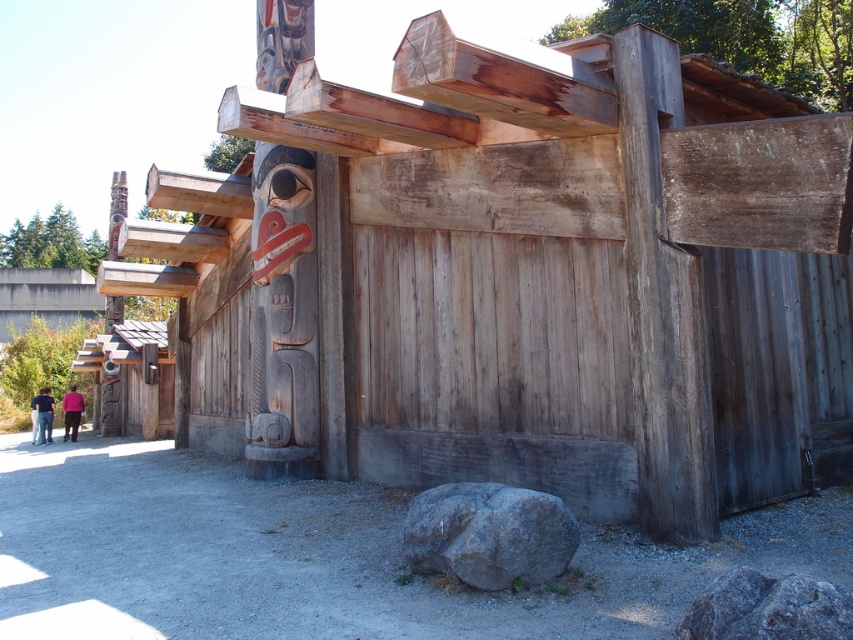
Question: Which of the following is the farthest from the observer?

Choices:
 (A) gray rough rock at lower right
 (B) gray rough rock at lower center
 (C) carved wood totem pole at left
 (D) carved wooden totem pole at center

Answer: (C)

Question: Considering the relative positions of gray rough rock at lower right and dark blue shirt at lower left in the image provided, where is gray rough rock at lower right located with respect to dark blue shirt at lower left?

Choices:
 (A) above
 (B) below

Answer: (A)

Question: Which object is positioned farthest from the pink fabric at lower left?

Choices:
 (A) carved wooden totem pole at center
 (B) gray rough rock at lower center
 (C) dark blue shirt at lower left
 (D) gray rough rock at lower right

Answer: (D)

Question: Which point appears closest to the camera in this image?

Choices:
 (A) (82, 410)
 (B) (49, 428)

Answer: (B)

Question: Does gray rough rock at lower right appear on the right side of dark blue shirt at lower left?

Choices:
 (A) yes
 (B) no

Answer: (A)

Question: Is gray rough rock at lower right positioned before pink fabric at lower left?

Choices:
 (A) yes
 (B) no

Answer: (A)